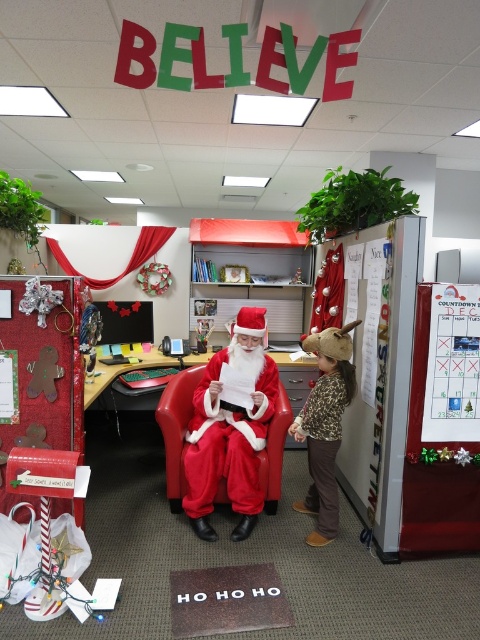
Is fuzzy red santa at center taller than leopard print sweater at center?

Correct, fuzzy red santa at center is much taller as leopard print sweater at center.

The image size is (480, 640). What do you see at coordinates (230, 429) in the screenshot?
I see `fuzzy red santa at center` at bounding box center [230, 429].

Identify the location of fuzzy red santa at center. click(230, 429).